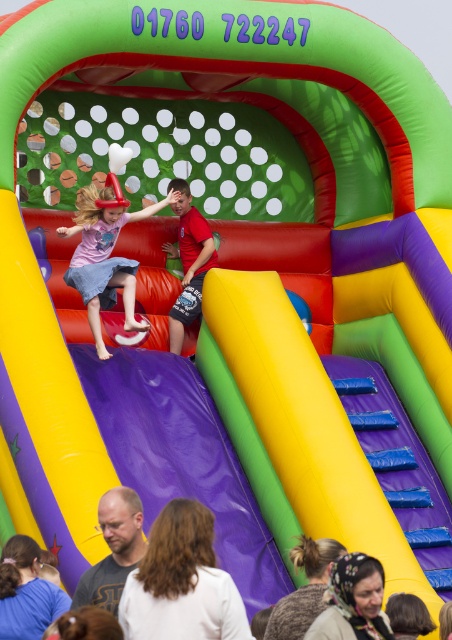
Question: Can you confirm if matte pink dress at center is wider than white cotton shirt at lower center?

Choices:
 (A) no
 (B) yes

Answer: (A)

Question: Can you confirm if matte pink dress at center is positioned to the right of white cotton shirt at lower center?

Choices:
 (A) no
 (B) yes

Answer: (A)

Question: In this image, where is matte pink dress at center located relative to white cotton shirt at lower center?

Choices:
 (A) left
 (B) right

Answer: (A)

Question: Which object appears farthest from the camera in this image?

Choices:
 (A) white cotton shirt at lower center
 (B) matte pink dress at center

Answer: (B)